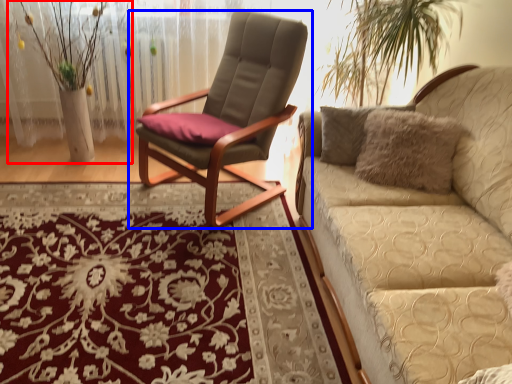
Question: Which of the following is the closest to the observer, floral arrangement (highlighted by a red box) or chair (highlighted by a blue box)?

Choices:
 (A) floral arrangement
 (B) chair

Answer: (B)